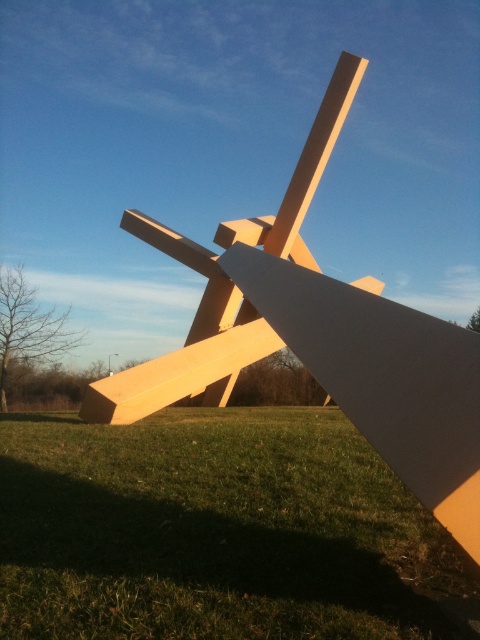
Question: Is green grass at lower center to the right of matte wood cross at center from the viewer's perspective?

Choices:
 (A) yes
 (B) no

Answer: (B)

Question: Among these points, which one is nearest to the camera?

Choices:
 (A) (228, 378)
 (B) (372, 492)

Answer: (B)

Question: Is green grass at lower center bigger than matte wood cross at center?

Choices:
 (A) yes
 (B) no

Answer: (B)

Question: Which of the following is the closest to the observer?

Choices:
 (A) (457, 612)
 (B) (252, 310)

Answer: (A)

Question: Which of the following is the closest to the observer?

Choices:
 (A) matte wood cross at center
 (B) green grass at lower center

Answer: (A)

Question: Is green grass at lower center behind matte wood cross at center?

Choices:
 (A) no
 (B) yes

Answer: (B)